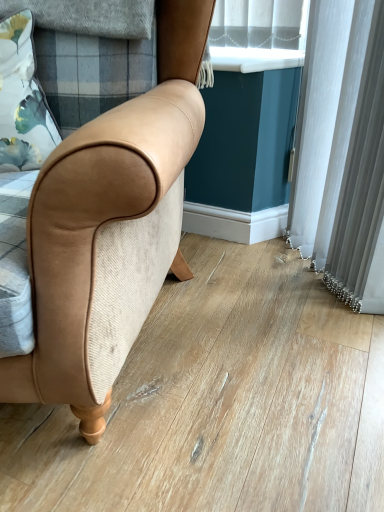
Question: Is floral fabric pillow at upper left in front of or behind white plastic window sill at upper center in the image?

Choices:
 (A) front
 (B) behind

Answer: (A)

Question: From a real-world perspective, is floral fabric pillow at upper left positioned above or below white plastic window sill at upper center?

Choices:
 (A) below
 (B) above

Answer: (A)

Question: Based on their relative distances, which object is farther from the tan leather chair at center?

Choices:
 (A) white plastic window sill at upper center
 (B) floral fabric pillow at upper left

Answer: (A)

Question: Based on their relative distances, which object is nearer to the tan leather chair at center?

Choices:
 (A) white plastic window sill at upper center
 (B) floral fabric pillow at upper left

Answer: (B)